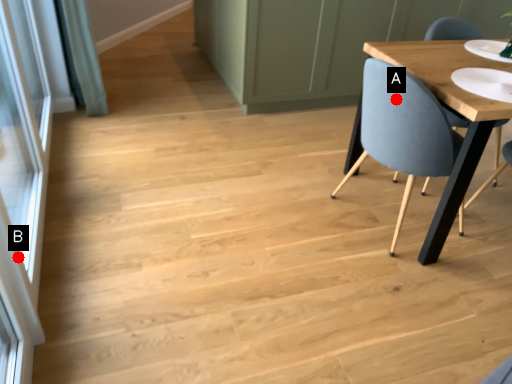
Question: Two points are circled on the image, labeled by A and B beside each circle. Which of the following is the closest to the observer?

Choices:
 (A) A is closer
 (B) B is closer

Answer: (B)